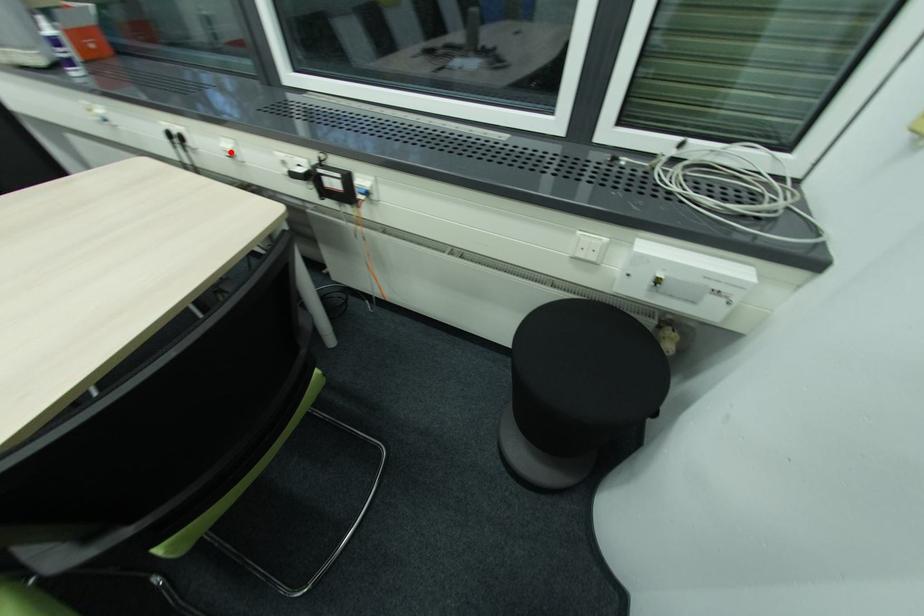
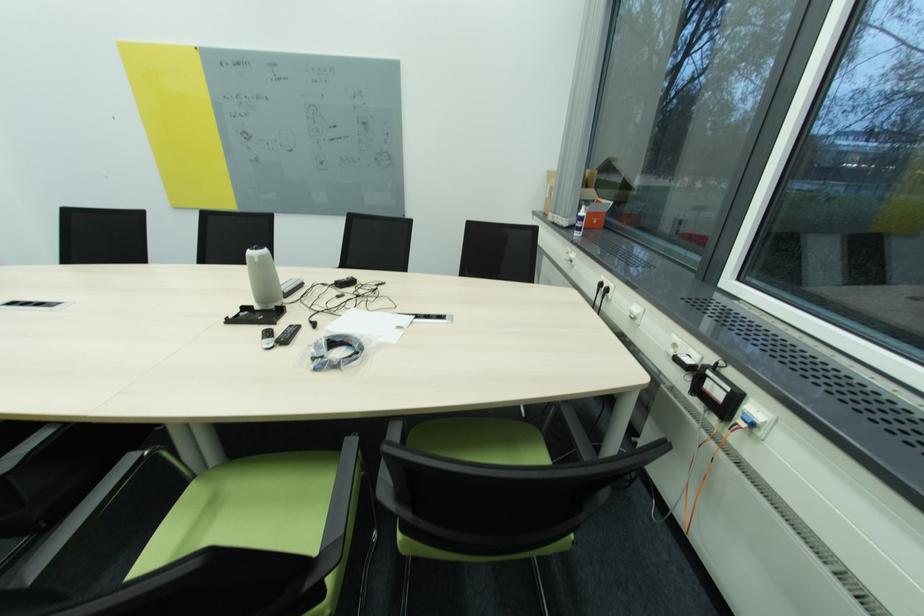
Locate, in the second image, the point that corresponds to the highlighted location in the first image.

(636, 314)